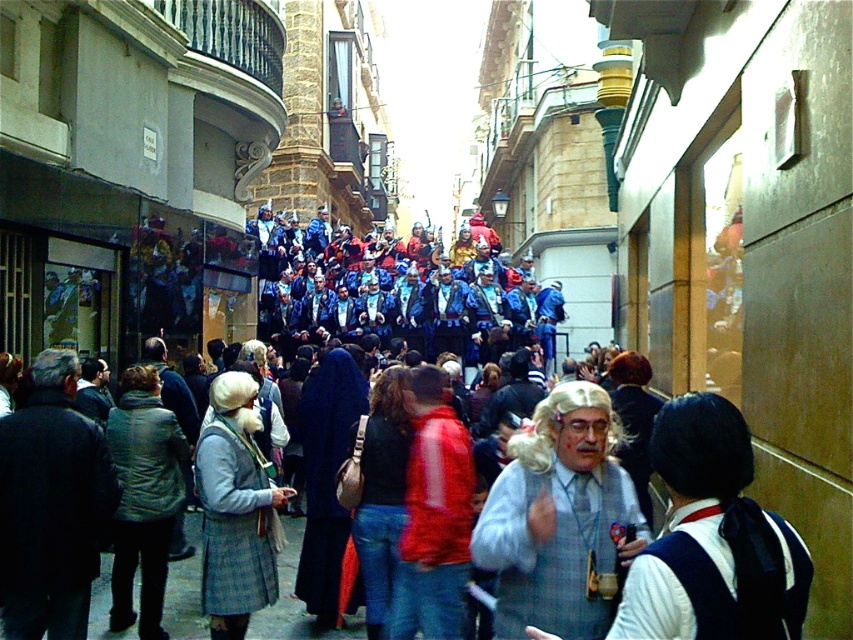
You are a photographer positioned at the end of the alleyway. You want to capture a photo of the white curly wig at center without including the blue fabric crowd at center in the frame. Which direction should you move to achieve this?

The blue fabric crowd at center is to the left of the white curly wig at center. To avoid including the blue fabric crowd at center in the photo, you should move to the right side of the alleyway so that the white curly wig at center remains in frame while the blue fabric crowd at center is out of view.

You are a photographer trying to capture a clear shot of the white curly wig at center without the blue fabric crowd at center blocking it. What adjustment should you make to your camera angle?

The blue fabric crowd at center is positioned over the white curly wig at center, so you should lower your camera angle to avoid the crowd blocking the wig.